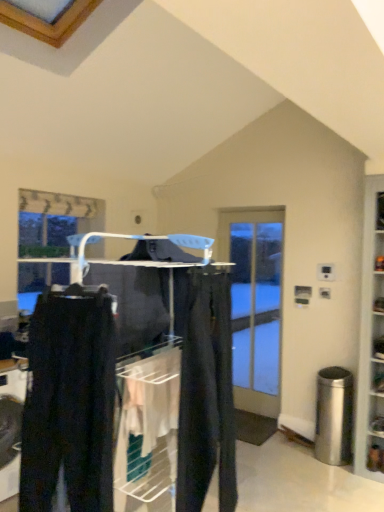
Question: Is dark gray pants at center completely or partially inside clear glass door at center?

Choices:
 (A) no
 (B) yes

Answer: (A)

Question: Considering the relative positions of clear glass door at center and dark gray pants at center in the image provided, is clear glass door at center behind dark gray pants at center?

Choices:
 (A) no
 (B) yes

Answer: (B)

Question: Can you confirm if clear glass door at center is shorter than dark gray pants at center?

Choices:
 (A) yes
 (B) no

Answer: (B)

Question: Does clear glass door at center have a greater width compared to dark gray pants at center?

Choices:
 (A) no
 (B) yes

Answer: (A)

Question: Is clear glass door at center positioned before dark gray pants at center?

Choices:
 (A) yes
 (B) no

Answer: (B)

Question: Relative to matte black pants at center, is matte black pants at center in front or behind?

Choices:
 (A) front
 (B) behind

Answer: (B)

Question: Is point (190, 310) positioned closer to the camera than point (203, 322)?

Choices:
 (A) closer
 (B) farther

Answer: (A)

Question: From a real-world perspective, is matte black pants at center above or below matte black pants at center?

Choices:
 (A) above
 (B) below

Answer: (A)

Question: In terms of width, does matte black pants at center look wider or thinner when compared to matte black pants at center?

Choices:
 (A) wide
 (B) thin

Answer: (B)

Question: From the image's perspective, is matte black pants at center located above or below dark gray pants at center?

Choices:
 (A) above
 (B) below

Answer: (B)

Question: In the image, is matte black pants at center positioned in front of or behind dark gray pants at center?

Choices:
 (A) behind
 (B) front

Answer: (A)

Question: Based on their positions, is matte black pants at center located to the left or right of dark gray pants at center?

Choices:
 (A) left
 (B) right

Answer: (B)

Question: Is matte black pants at center wider or thinner than dark gray pants at center?

Choices:
 (A) thin
 (B) wide

Answer: (A)

Question: Looking at the image, does dark gray pants at center seem bigger or smaller compared to matte black pants at center?

Choices:
 (A) big
 (B) small

Answer: (B)

Question: Do you think dark gray pants at center is within matte black pants at center, or outside of it?

Choices:
 (A) outside
 (B) inside

Answer: (A)